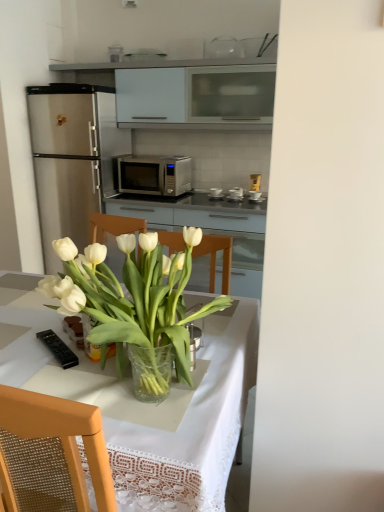
Question: Which is correct: black plastic remote control at lower left, acting as the second appliance starting from the right, is inside translucent glass vase at center, or outside of it?

Choices:
 (A) outside
 (B) inside

Answer: (A)

Question: Is black plastic remote control at lower left, the first appliance viewed from the left, bigger or smaller than translucent glass vase at center?

Choices:
 (A) small
 (B) big

Answer: (A)

Question: Which object is the farthest from the metallic silver toaster at center, placed as the first appliance when sorted from back to front?

Choices:
 (A) satin silver microwave at center
 (B) white matte cabinet at upper center
 (C) black plastic remote control at lower left, acting as the second appliance starting from the right
 (D) transparent glass vase at center
 (E) translucent glass vase at center

Answer: (E)

Question: Based on their relative distances, which object is nearer to the black plastic remote control at lower left, which ranks as the 2th appliance in back-to-front order?

Choices:
 (A) translucent glass vase at center
 (B) white matte cabinet at upper center
 (C) satin silver microwave at center
 (D) transparent glass vase at center
 (E) metallic silver toaster at center, arranged as the 1th appliance when viewed from the top

Answer: (A)